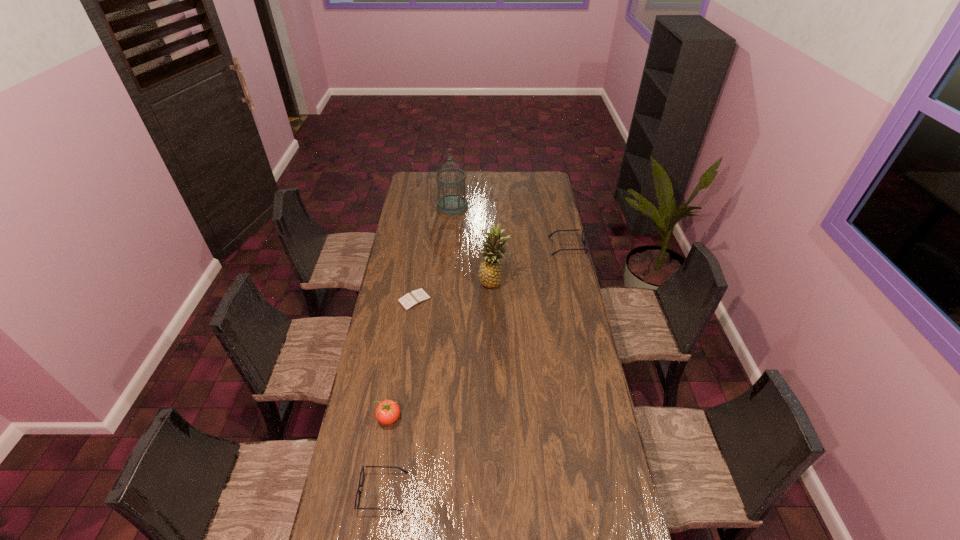
The height and width of the screenshot is (540, 960). I want to click on the shorter spectacles, so click(x=357, y=499).

At what (x,y) coordinates should I click in order to perform the action: click on the nearer spectacles. Please return your answer as a coordinate pair (x, y). This screenshot has width=960, height=540. Looking at the image, I should click on (357, 499).

The width and height of the screenshot is (960, 540). What are the coordinates of `the farther spectacles` in the screenshot? It's located at (584, 240).

Where is `the rightmost object`? the rightmost object is located at coordinates (584, 240).

Find the location of a particular element. The height and width of the screenshot is (540, 960). the shortest object is located at coordinates (415, 297).

Find the location of a particular element. the farthest object is located at coordinates (452, 204).

You are a GUI agent. You are given a task and a screenshot of the screen. Output one action in this format:
    pyautogui.click(x=<x>, y=<y>)
    Task: Click on the pineapple
    
    Given the screenshot: What is the action you would take?
    pyautogui.click(x=490, y=271)

Image resolution: width=960 pixels, height=540 pixels. I want to click on the second nearest object, so click(x=387, y=412).

I want to click on tomato, so click(x=387, y=412).

Locate an element on the screen. The image size is (960, 540). free region located 0.320m on the back of the shortest object is located at coordinates (422, 246).